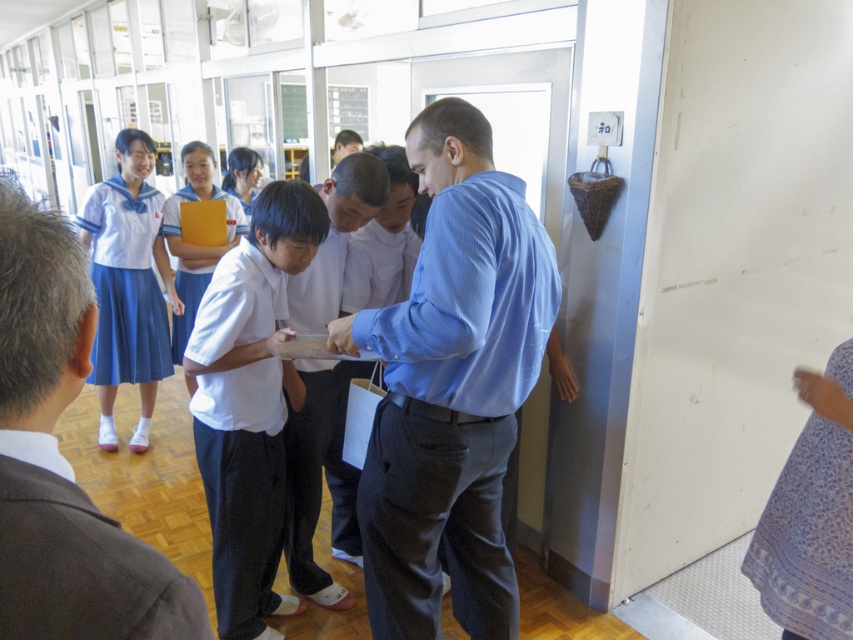
You are a student in the classroom and want to hand a note to the person wearing the light blue striped shirt at center. Which direction should you move to reach them first, considering the positions of the white matte uniform at upper left?

The white matte uniform at upper left is in front of the light blue striped shirt at center, so you should move around or behind the white matte uniform at upper left to reach the light blue striped shirt at center first.

You are a photographer trying to capture a photo of the scene. You need to ensure that both the blue striped shirt at center and the white cotton school uniform at lower left are clearly visible in the frame. Given their height difference, which one might you need to adjust your camera angle to focus on more carefully?

The blue striped shirt at center is taller than the white cotton school uniform at lower left. To ensure both are clearly visible, you might need to adjust your camera angle to focus more carefully on the white cotton school uniform at lower left since it is shorter and could be partially obscured if not properly framed.

You are a student in the classroom and need to locate the white matte uniform at upper left. Where exactly is it positioned in the image?

The white matte uniform at upper left is located at point coordinates of 0.720 on the x axis and 0.075 on the y axis.